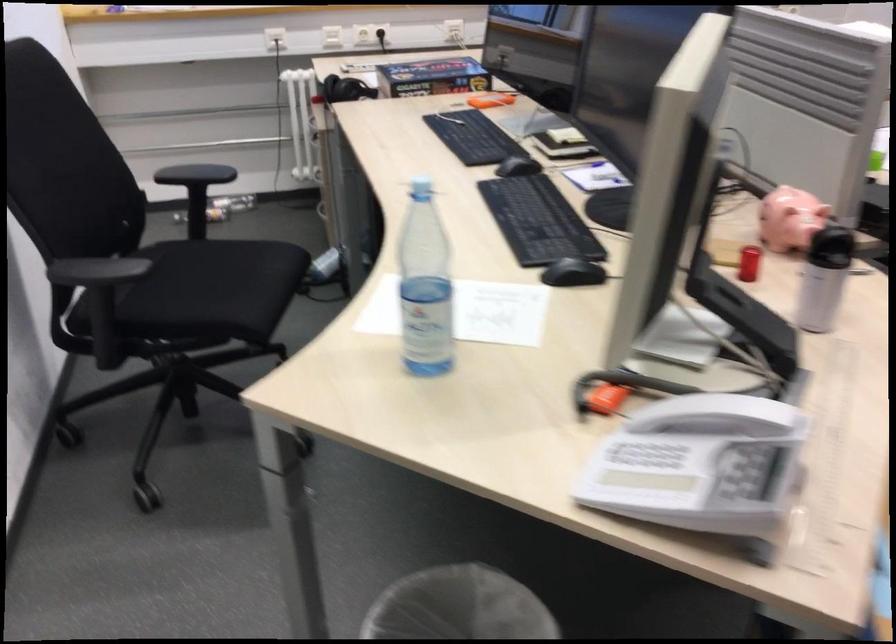
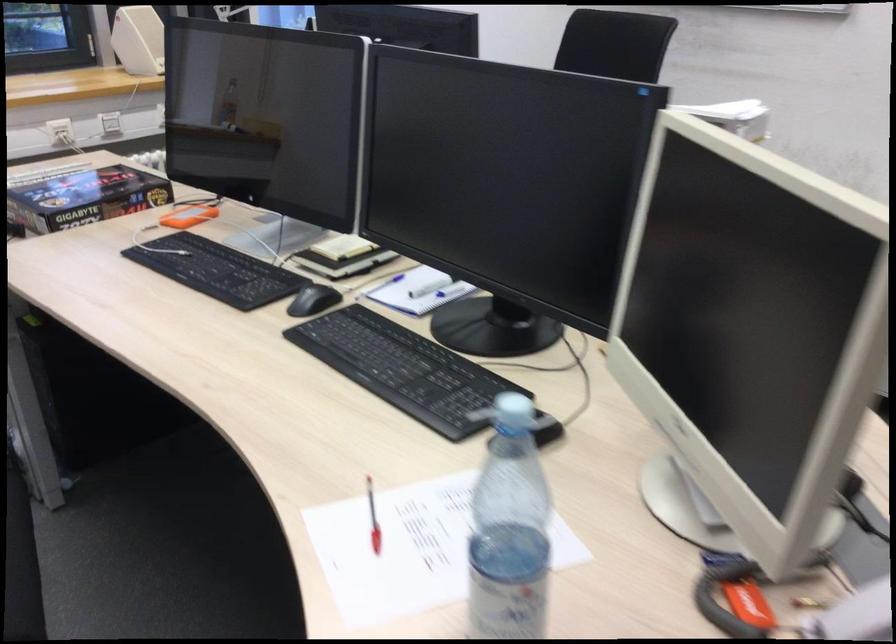
Locate, in the second image, the point that corresponds to point 423,73 in the first image.

(83, 198)